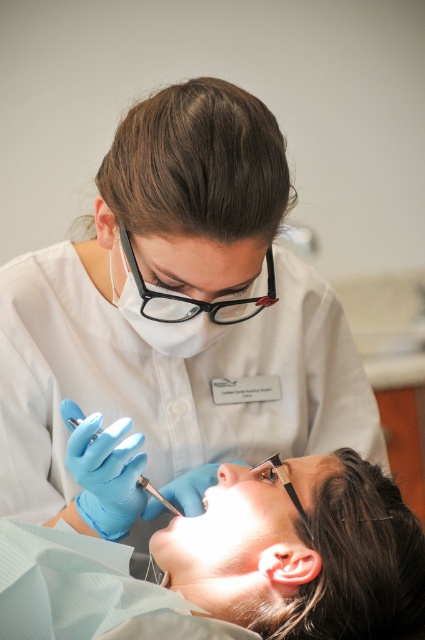
What are the coordinates of the matte blue gloves at lower left?

The matte blue gloves at lower left are located at point [234,564].

You are a dental assistant who needs to grab the matte blue gloves at lower left and blue rubber gloves at left to hand them to the dentist. How far apart are these two items?

The matte blue gloves at lower left and blue rubber gloves at left are 19.47 centimeters apart.